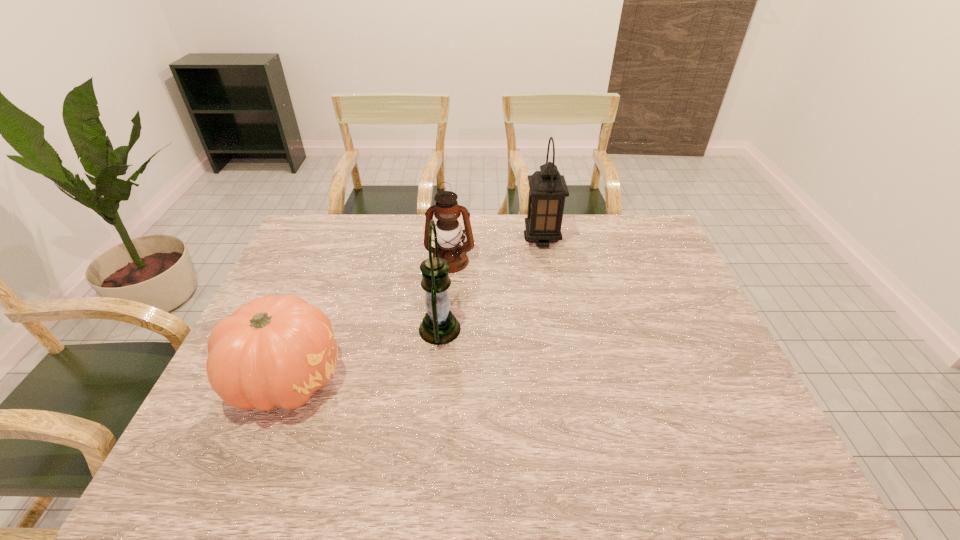
Locate an element on the screen. The height and width of the screenshot is (540, 960). free spot that satisfies the following two spatial constraints: 1. on the front side of the rightmost object; 2. on the side where the nearest lantern emits light is located at coordinates (558, 329).

The height and width of the screenshot is (540, 960). I want to click on vacant area that satisfies the following two spatial constraints: 1. on the side of the shortest lantern, there is a wick adjustment knob; 2. on the side where the nearest lantern emits light, so click(444, 329).